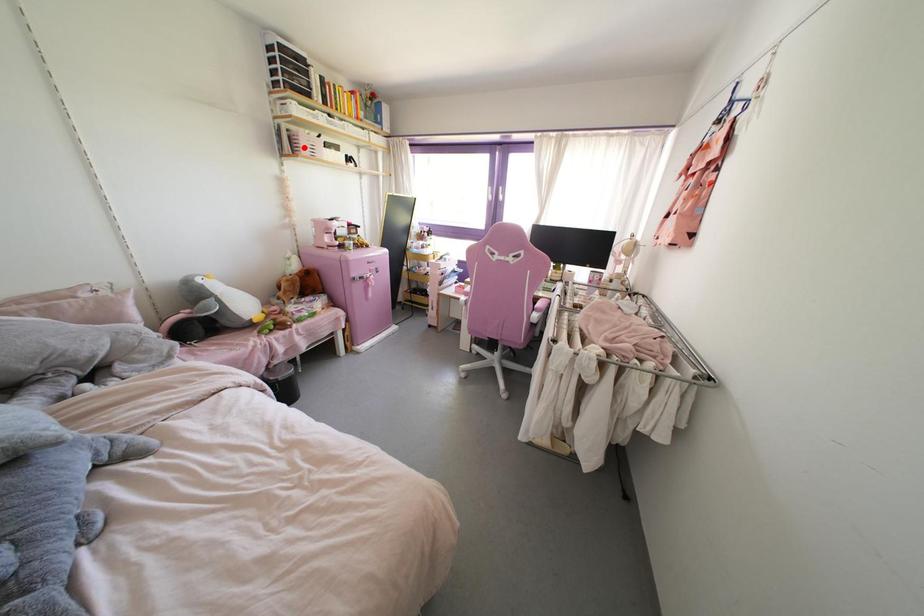
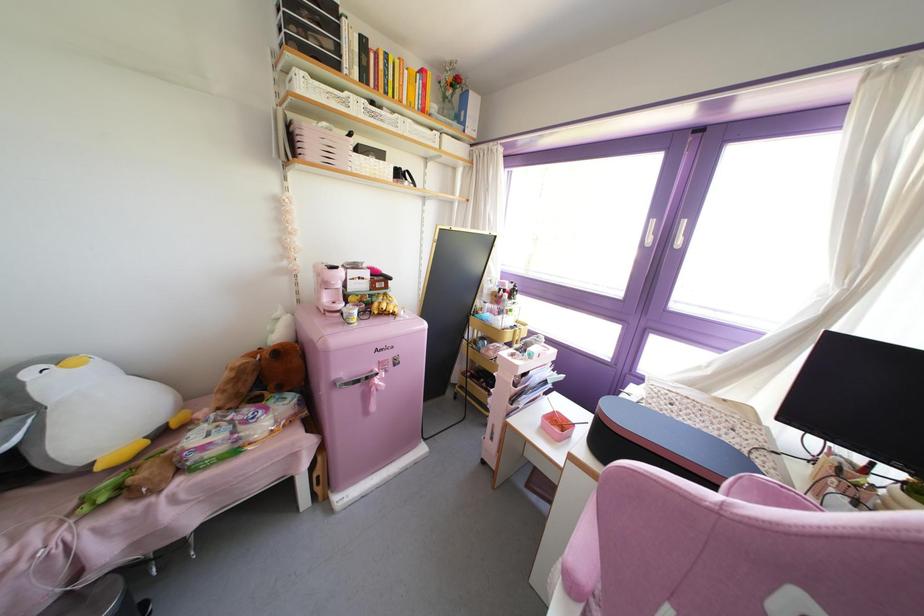
In the second image, find the point that corresponds to the highlighted location in the first image.

(310, 148)